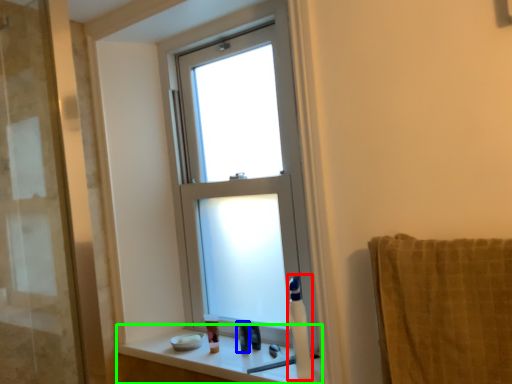
Question: Which object is the farthest from soap dispenser (highlighted by a red box)? Choose among these: toiletry (highlighted by a blue box) or window sill (highlighted by a green box).

Choices:
 (A) toiletry
 (B) window sill

Answer: (A)